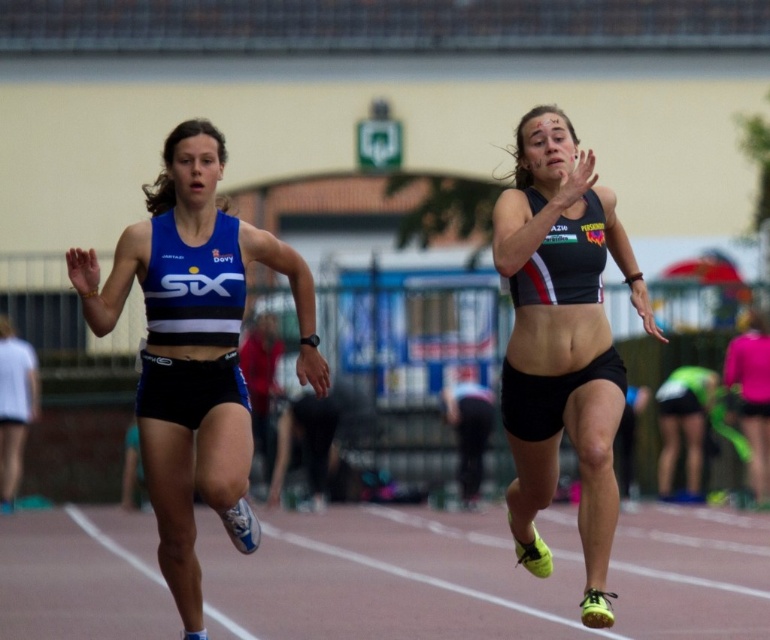
Question: Which of the following is the closest to the observer?

Choices:
 (A) blue matte sports bra at left
 (B) black matte sports bra at upper right

Answer: (B)

Question: Does blue matte sports bra at left have a lesser width compared to black matte sports bra at upper right?

Choices:
 (A) no
 (B) yes

Answer: (A)

Question: Does blue matte sports bra at left appear over black matte sports bra at upper right?

Choices:
 (A) no
 (B) yes

Answer: (A)

Question: Does blue matte sports bra at left appear on the right side of black matte sports bra at upper right?

Choices:
 (A) no
 (B) yes

Answer: (A)